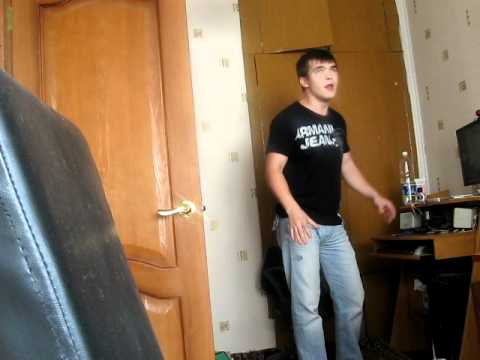
The height and width of the screenshot is (360, 480). In order to click on drawer in this screenshot , I will do `click(443, 243)`, `click(450, 289)`, `click(461, 217)`.